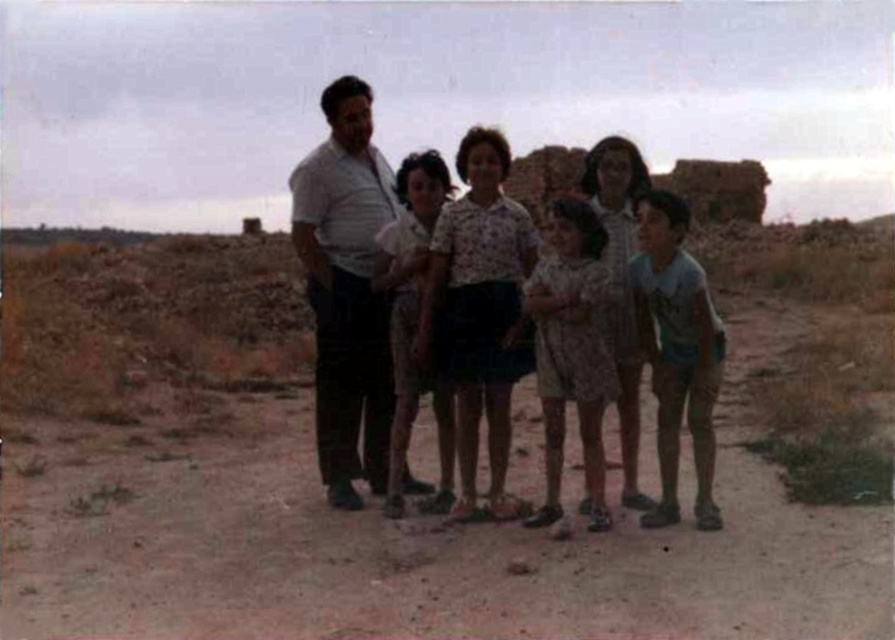
Does white cotton shirt at center have a lesser width compared to dotted fabric dress at center?

No, white cotton shirt at center is not thinner than dotted fabric dress at center.

Does white cotton shirt at center appear over dotted fabric dress at center?

Yes, white cotton shirt at center is above dotted fabric dress at center.

Locate an element on the screen. This screenshot has height=640, width=895. white cotton shirt at center is located at coordinates (339, 275).

The width and height of the screenshot is (895, 640). Find the location of `white cotton shirt at center`. white cotton shirt at center is located at coordinates (339, 275).

Is point (347, 504) closer to viewer compared to point (362, 371)?

Yes.

Is point (329, 86) positioned before point (330, 387)?

No, (329, 86) is further to viewer.

Locate an element on the screen. The height and width of the screenshot is (640, 895). white cotton shirt at center is located at coordinates (339, 275).

Describe the element at coordinates (572, 352) in the screenshot. This screenshot has height=640, width=895. I see `dotted fabric dress at center` at that location.

Describe the element at coordinates (572, 352) in the screenshot. The height and width of the screenshot is (640, 895). I see `dotted fabric dress at center` at that location.

You are a GUI agent. You are given a task and a screenshot of the screen. Output one action in this format:
    pyautogui.click(x=<x>, y=<y>)
    Task: Click on the dotted fabric dress at center
    
    Given the screenshot: What is the action you would take?
    pyautogui.click(x=572, y=352)